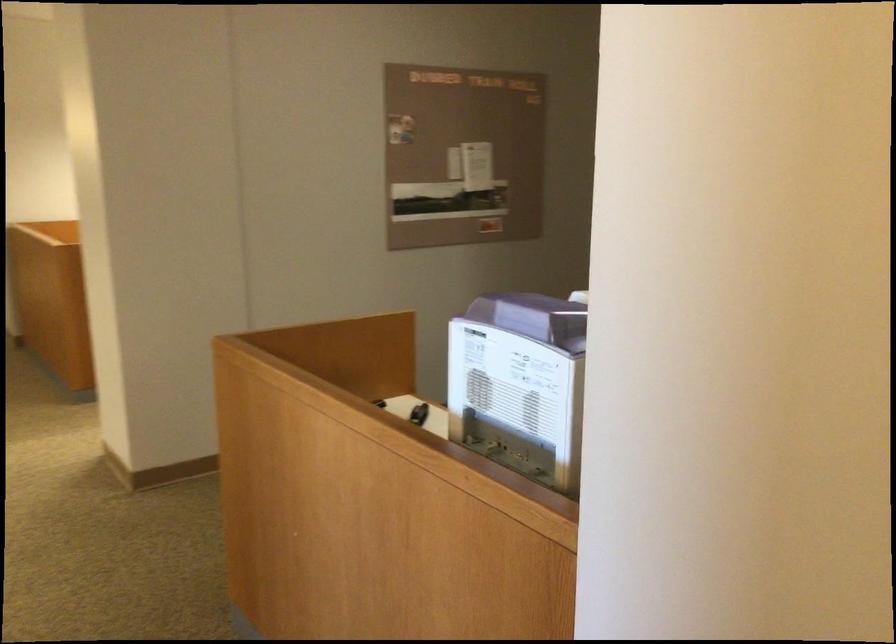
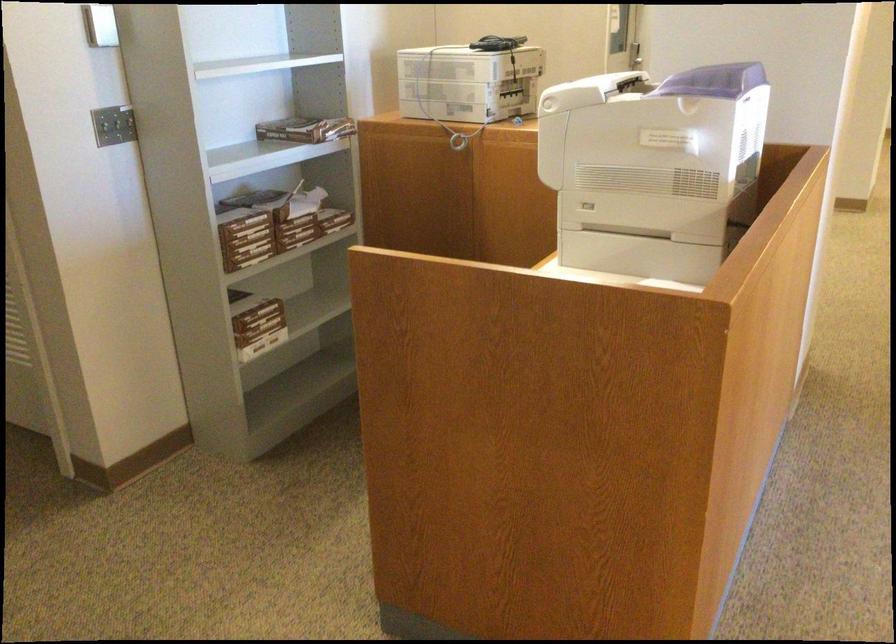
Find the pixel in the second image that matches pixel 476 330 in the first image.

(714, 80)